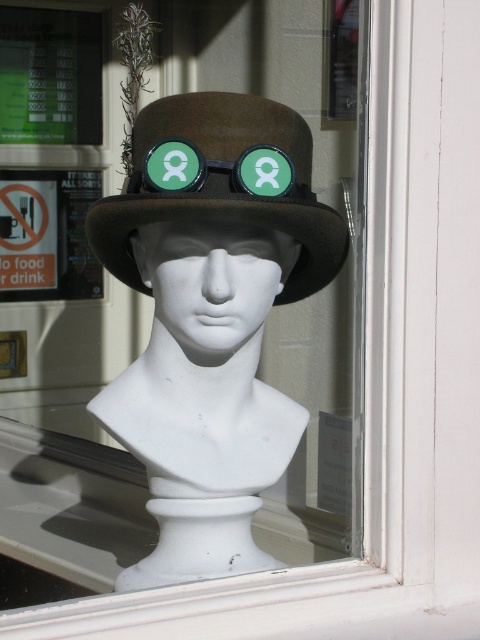
Question: Does matte brown bust at center appear over brown felt hat at center?

Choices:
 (A) yes
 (B) no

Answer: (B)

Question: Is white matte bust at center closer to camera compared to green matte goggles at center?

Choices:
 (A) no
 (B) yes

Answer: (A)

Question: Which object appears closest to the camera in this image?

Choices:
 (A) matte brown bust at center
 (B) green matte goggles at center
 (C) white matte bust at center

Answer: (A)

Question: Which point is farther to the camera?

Choices:
 (A) green matte goggles at center
 (B) white matte bust at center

Answer: (B)

Question: Can you confirm if matte brown bust at center is smaller than brown felt hat at center?

Choices:
 (A) yes
 (B) no

Answer: (B)

Question: Which of these objects is positioned farthest from the matte brown bust at center?

Choices:
 (A) brown felt hat at center
 (B) white matte bust at center
 (C) green matte goggles at center

Answer: (C)